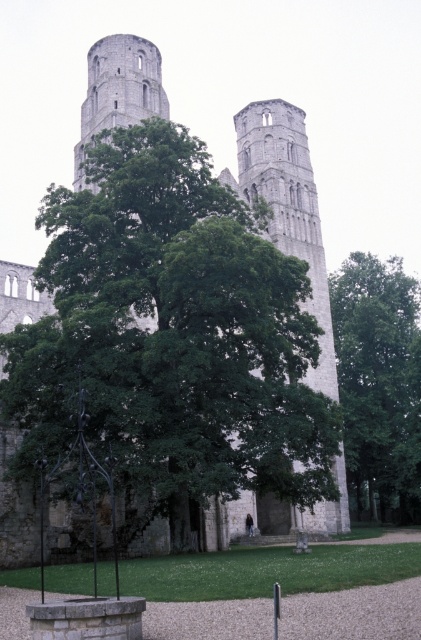
Who is shorter, green leafy tree at center or gray stone tower at center?

green leafy tree at center is shorter.

This screenshot has height=640, width=421. What do you see at coordinates (173, 332) in the screenshot? I see `green leafy tree at center` at bounding box center [173, 332].

Identify the location of green leafy tree at center. (173, 332).

Which of these two, green leafy tree at center or green leafy tree at right, stands shorter?

With less height is green leafy tree at center.

Between green leafy tree at center and green leafy tree at right, which one appears on the right side from the viewer's perspective?

green leafy tree at right is more to the right.

Between point (152, 308) and point (367, 310), which one is positioned behind?

The point (367, 310) is behind.

The image size is (421, 640). Find the location of `green leafy tree at center`. green leafy tree at center is located at coordinates [173, 332].

Is point (399, 396) positioned after point (287, 166)?

Yes, it is.

This screenshot has width=421, height=640. What are the coordinates of `green leafy tree at right` in the screenshot? It's located at (378, 384).